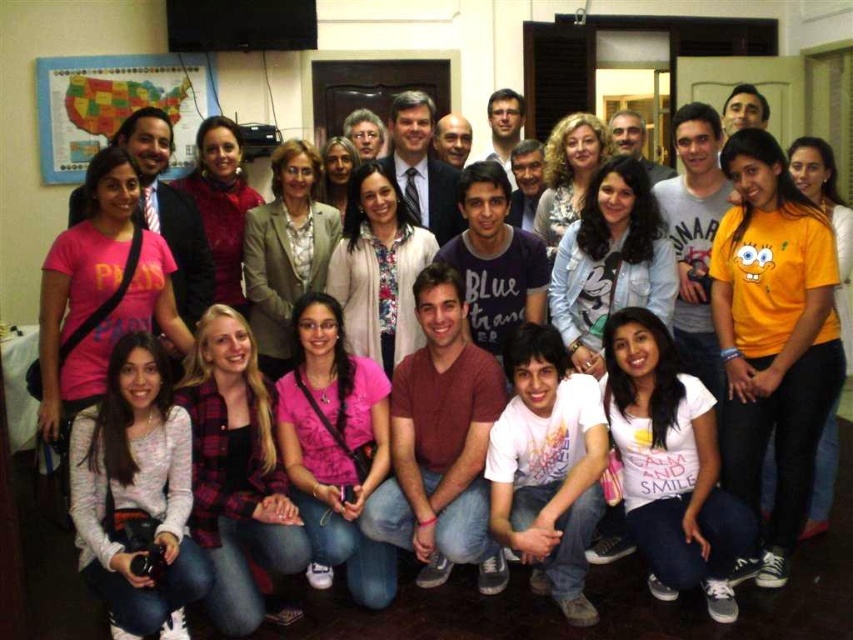
Does white cotton t-shirt at lower center appear over pink fabric shirt at center?

Actually, white cotton t-shirt at lower center is below pink fabric shirt at center.

Which is behind, point (680, 566) or point (328, 403)?

Positioned behind is point (328, 403).

Where is `white cotton t-shirt at lower center`? The height and width of the screenshot is (640, 853). white cotton t-shirt at lower center is located at coordinates (670, 465).

Between white knit sweater at lower left and white cotton t-shirt at lower center, which one is positioned lower?

white knit sweater at lower left

Does white knit sweater at lower left have a greater width compared to white cotton t-shirt at lower center?

Indeed, white knit sweater at lower left has a greater width compared to white cotton t-shirt at lower center.

Is point (143, 605) positioned in front of point (625, 458)?

Yes, point (143, 605) is in front of point (625, 458).

The image size is (853, 640). Identify the location of white knit sweater at lower left. (136, 497).

Does white knit sweater at lower left have a smaller size compared to pink fabric shirt at center?

Correct, white knit sweater at lower left occupies less space than pink fabric shirt at center.

The height and width of the screenshot is (640, 853). Find the location of `white knit sweater at lower left`. white knit sweater at lower left is located at coordinates (136, 497).